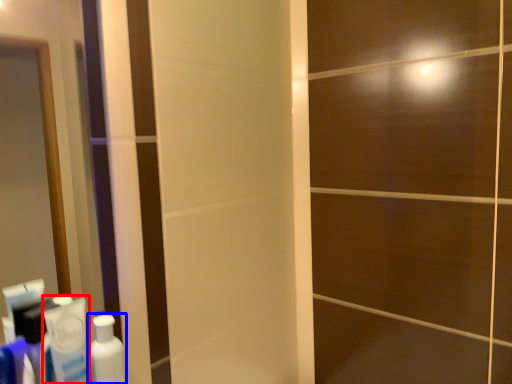
Question: Which object is further to the camera taking this photo, toothpaste (highlighted by a red box) or bottle (highlighted by a blue box)?

Choices:
 (A) toothpaste
 (B) bottle

Answer: (B)